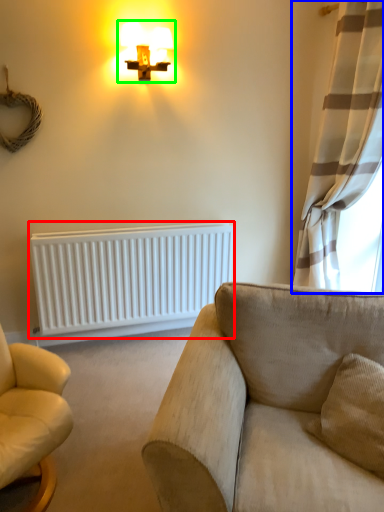
Question: Which is nearer to the radiator (highlighted by a red box)? curtain (highlighted by a blue box) or lamp (highlighted by a green box).

Choices:
 (A) curtain
 (B) lamp

Answer: (A)